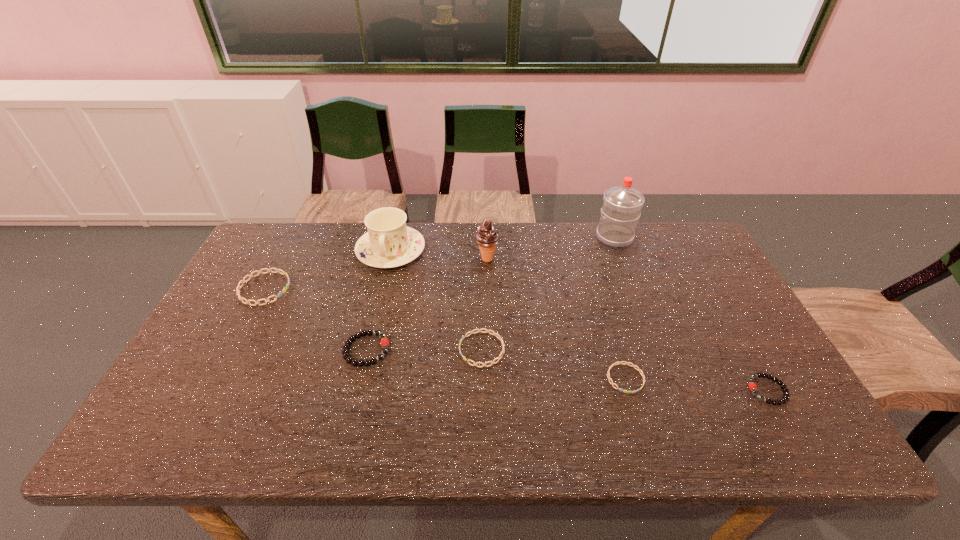
Identify which blue bracelet is the nearest to the farthest bracelet. Please provide its 2D coordinates. Your answer should be formatted as a tuple, i.e. [(x, y)], where the tuple contains the x and y coordinates of a point satisfying the conditions above.

[(479, 330)]

You are a GUI agent. You are given a task and a screenshot of the screen. Output one action in this format:
    pyautogui.click(x=<x>, y=<y>)
    Task: Click on the vacant area that satisfies the following two spatial constraints: 1. on the surface of the rightmost bracelet showing star-shaped elements; 2. on the right side of the leftmost blue bracelet
    The width and height of the screenshot is (960, 540).
    Given the screenshot: What is the action you would take?
    pyautogui.click(x=211, y=390)

Image resolution: width=960 pixels, height=540 pixels. I want to click on vacant space that satisfies the following two spatial constraints: 1. on the surface of the leftmost blue bracelet showing star-shaped elements; 2. on the left side of the smaller black bracelet, so click(211, 390).

This screenshot has height=540, width=960. In order to click on free location that satisfies the following two spatial constraints: 1. on the handle side of the rightmost bracelet; 2. on the right side of the sixth shortest object in this screenshot , I will do `click(357, 390)`.

The height and width of the screenshot is (540, 960). In order to click on free space in the image that satisfies the following two spatial constraints: 1. on the handle side of the sixth shortest object; 2. on the left side of the rightmost bracelet in this screenshot , I will do `click(357, 390)`.

Image resolution: width=960 pixels, height=540 pixels. Find the location of `blank space that satisfies the following two spatial constraints: 1. on the handle side of the smaller black bracelet; 2. on the left side of the third tallest object`. blank space that satisfies the following two spatial constraints: 1. on the handle side of the smaller black bracelet; 2. on the left side of the third tallest object is located at coordinates (357, 390).

Locate an element on the screen. Image resolution: width=960 pixels, height=540 pixels. free space that satisfies the following two spatial constraints: 1. on the handle side of the second tallest object; 2. on the left side of the sixth shortest object is located at coordinates (389, 259).